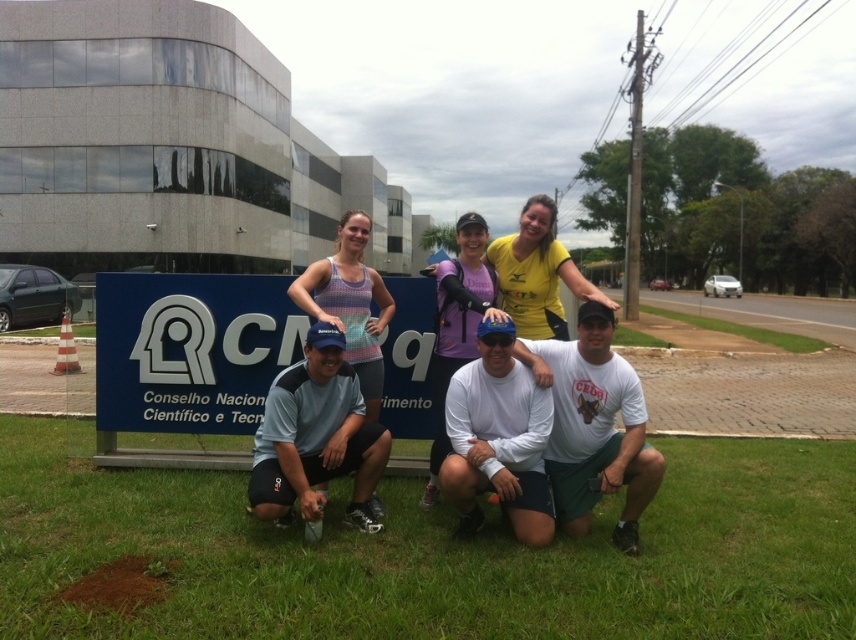
You are standing in front of the large blue signboard with the group. If you look down, where would you see the green grass at lower center?

The green grass at lower center is located at point (434, 554).

You are a photographer who needs to ensure that the green grass at lower center and the blue fabric cap at center are both visible in the photo. Considering their heights, which object might require you to adjust your camera angle to capture both effectively?

The green grass at lower center has a lesser height compared to blue fabric cap at center, so you might need to lower the camera angle to ensure both are visible.